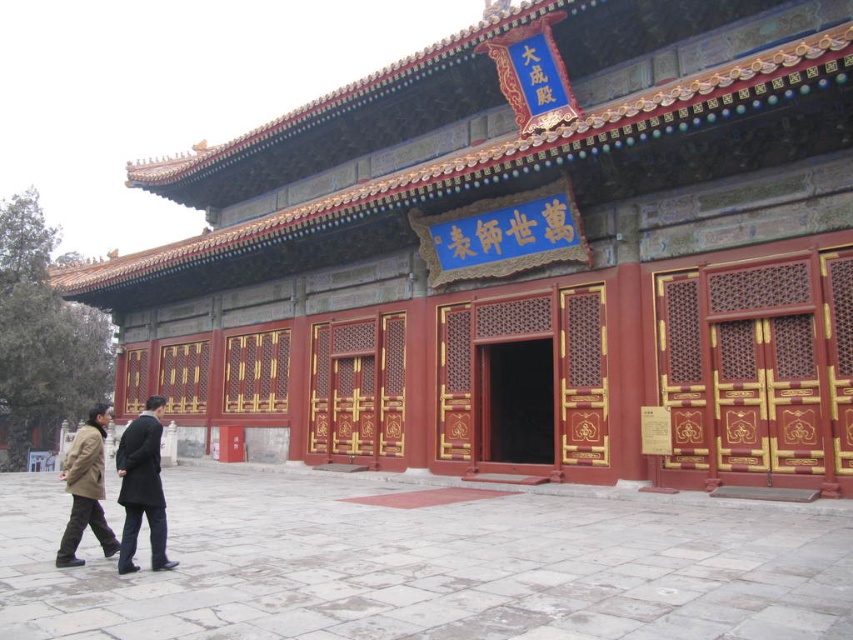
You are a visitor at the Great Sage Temple and notice two coats hanging on a rack near the entrance. The coats are the dark gray wool coat at lower left and the brown leather jacket at lower left. Which coat is shorter in height?

The dark gray wool coat at lower left is not as tall as the brown leather jacket at lower left, so the dark gray wool coat at lower left is shorter in height.

You are standing in front of the Great Sage Temple and want to take a photo of the matte red wood palace at center and the brown leather jacket at lower left. Which object should you focus on first to ensure it appears larger in your photo?

You should focus on the matte red wood palace at center first because it is closer to you than the brown leather jacket at lower left, making it appear larger in the photo.